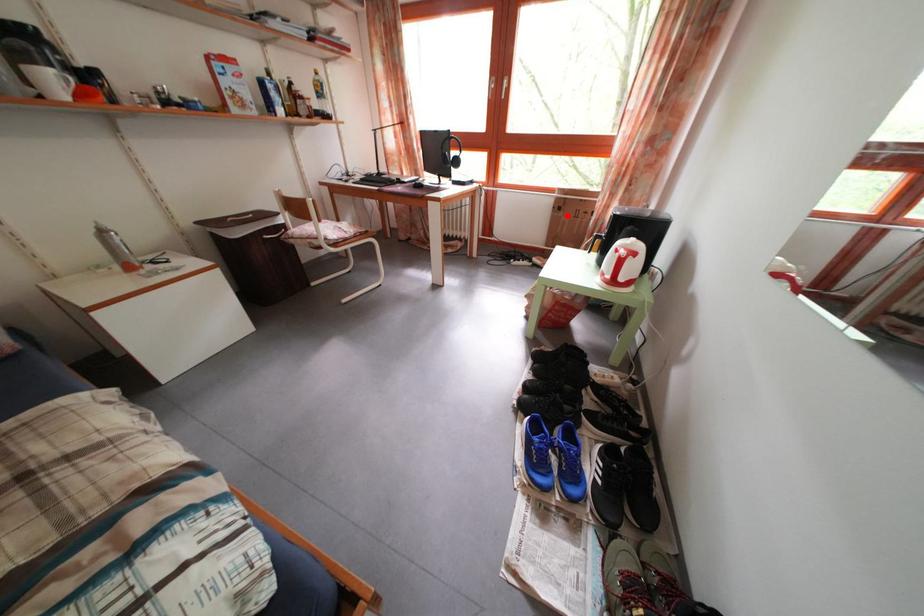
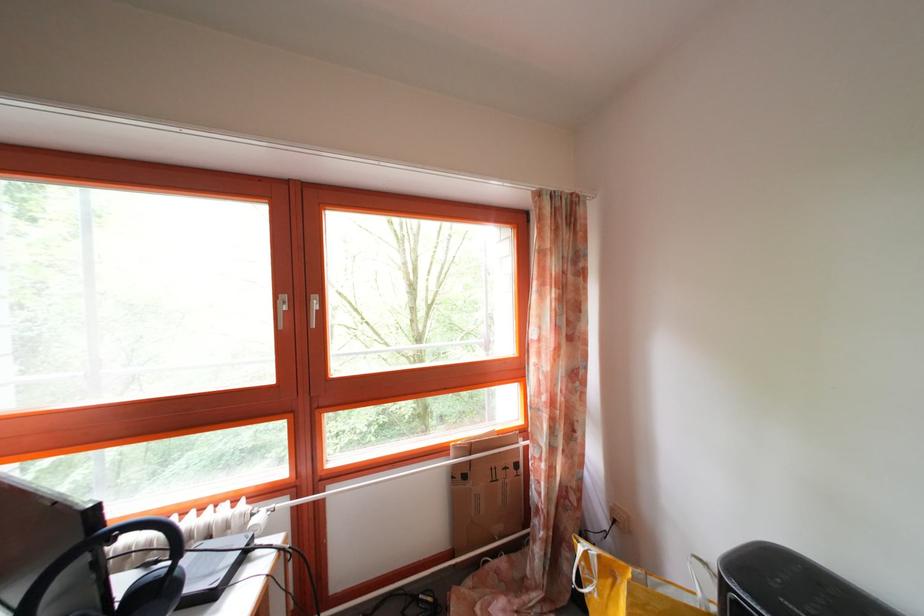
Locate, in the second image, the point that corresponds to the highlighted location in the first image.

(472, 484)